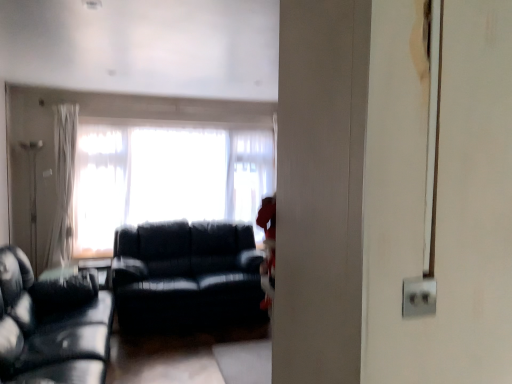
Question: Does black leather couch at left, the 2th studio couch in the back-to-front sequence, have a lesser width compared to matte black couch at center, the 2th studio couch when ordered from front to back?

Choices:
 (A) yes
 (B) no

Answer: (A)

Question: Can you confirm if black leather couch at left, the 2th studio couch in the back-to-front sequence, is positioned to the left of matte black couch at center, the 2th studio couch when ordered from front to back?

Choices:
 (A) no
 (B) yes

Answer: (B)

Question: Does black leather couch at left, which ranks as the first studio couch in front-to-back order, come behind matte black couch at center, the 2th studio couch when ordered from front to back?

Choices:
 (A) no
 (B) yes

Answer: (A)

Question: Is black leather couch at left, the 2th studio couch in the back-to-front sequence, at the right side of matte black couch at center, the 2th studio couch when ordered from front to back?

Choices:
 (A) no
 (B) yes

Answer: (A)

Question: Can you confirm if black leather couch at left, the 2th studio couch in the back-to-front sequence, is shorter than matte black couch at center, the 1th studio couch when ordered from back to front?

Choices:
 (A) no
 (B) yes

Answer: (B)

Question: Is black leather couch at left, which ranks as the first studio couch in front-to-back order, aimed at matte black couch at center, the 2th studio couch when ordered from front to back?

Choices:
 (A) no
 (B) yes

Answer: (B)

Question: Considering the relative sizes of white sheer curtain at left and translucent fabric window at center in the image provided, is white sheer curtain at left bigger than translucent fabric window at center?

Choices:
 (A) yes
 (B) no

Answer: (B)

Question: Could you tell me if white sheer curtain at left is turned towards translucent fabric window at center?

Choices:
 (A) yes
 (B) no

Answer: (B)

Question: From a real-world perspective, is white sheer curtain at left beneath translucent fabric window at center?

Choices:
 (A) no
 (B) yes

Answer: (A)

Question: Can you confirm if white sheer curtain at left is positioned to the right of translucent fabric window at center?

Choices:
 (A) yes
 (B) no

Answer: (B)

Question: Considering the relative sizes of white sheer curtain at left and translucent fabric window at center in the image provided, is white sheer curtain at left smaller than translucent fabric window at center?

Choices:
 (A) yes
 (B) no

Answer: (A)

Question: Would you say white sheer curtain at left is outside translucent fabric window at center?

Choices:
 (A) no
 (B) yes

Answer: (B)

Question: Is translucent fabric window at center outside of matte black couch at center, the 2th studio couch when ordered from front to back?

Choices:
 (A) yes
 (B) no

Answer: (A)